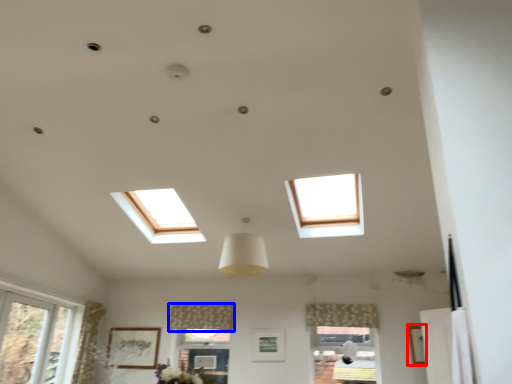
Question: Which point is further to the camera, picture frame (highlighted by a red box) or curtain (highlighted by a blue box)?

Choices:
 (A) picture frame
 (B) curtain

Answer: (B)